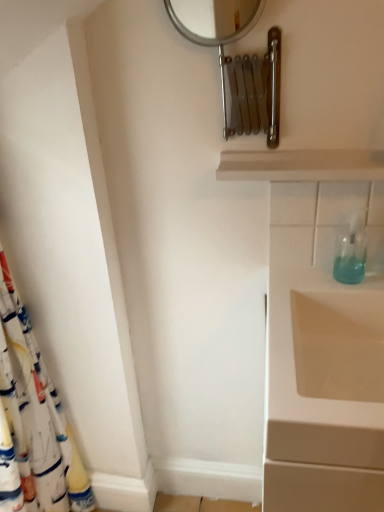
Question: From the image's perspective, is white wood shelf at upper center below transparent plastic soap dispenser at right?

Choices:
 (A) yes
 (B) no

Answer: (B)

Question: Is white wood shelf at upper center positioned beyond the bounds of transparent plastic soap dispenser at right?

Choices:
 (A) yes
 (B) no

Answer: (A)

Question: Can you confirm if white wood shelf at upper center is thinner than transparent plastic soap dispenser at right?

Choices:
 (A) no
 (B) yes

Answer: (A)

Question: Is white wood shelf at upper center directly adjacent to transparent plastic soap dispenser at right?

Choices:
 (A) no
 (B) yes

Answer: (A)

Question: Is white wood shelf at upper center positioned before transparent plastic soap dispenser at right?

Choices:
 (A) yes
 (B) no

Answer: (A)

Question: Is white wood shelf at upper center positioned with its back to transparent plastic soap dispenser at right?

Choices:
 (A) yes
 (B) no

Answer: (B)

Question: From a real-world perspective, is white fabric shower curtain at left positioned under silver metallic mirror at upper center based on gravity?

Choices:
 (A) yes
 (B) no

Answer: (A)

Question: Is the position of white fabric shower curtain at left more distant than that of silver metallic mirror at upper center?

Choices:
 (A) no
 (B) yes

Answer: (B)

Question: Can you see white fabric shower curtain at left touching silver metallic mirror at upper center?

Choices:
 (A) yes
 (B) no

Answer: (B)

Question: From the image's perspective, would you say white fabric shower curtain at left is shown under silver metallic mirror at upper center?

Choices:
 (A) no
 (B) yes

Answer: (B)

Question: Considering the relative sizes of white fabric shower curtain at left and silver metallic mirror at upper center in the image provided, is white fabric shower curtain at left thinner than silver metallic mirror at upper center?

Choices:
 (A) no
 (B) yes

Answer: (A)

Question: Are white fabric shower curtain at left and silver metallic mirror at upper center located far from each other?

Choices:
 (A) no
 (B) yes

Answer: (A)

Question: Does white fabric shower curtain at left have a smaller size compared to white wood shelf at upper center?

Choices:
 (A) no
 (B) yes

Answer: (A)